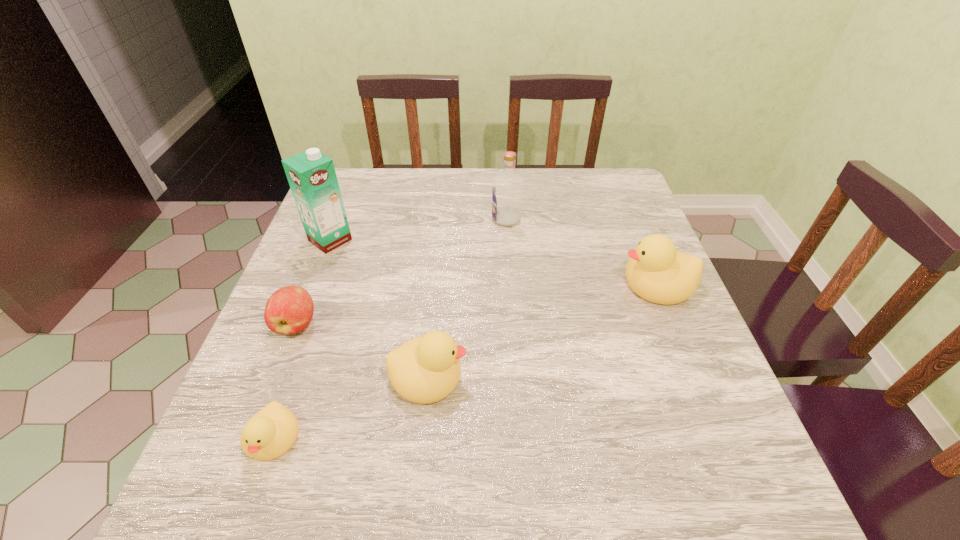
The image size is (960, 540). In order to click on vacant area that lies between the apple and the carton in this screenshot , I will do `click(313, 282)`.

The width and height of the screenshot is (960, 540). I want to click on vacant point located between the shortest object and the tallest object, so click(301, 339).

The image size is (960, 540). I want to click on blank region between the carton and the leftmost duckling, so click(301, 339).

Where is `vacant area between the second shortest object and the leftmost duckling`? The image size is (960, 540). vacant area between the second shortest object and the leftmost duckling is located at coordinates (284, 381).

Where is `unoccupied area between the tallest object and the vodka`? unoccupied area between the tallest object and the vodka is located at coordinates (419, 230).

Locate an element on the screen. Image resolution: width=960 pixels, height=540 pixels. vacant area between the second tallest duckling and the nearest duckling is located at coordinates (350, 407).

What are the coordinates of `empty location between the shortest duckling and the carton` in the screenshot? It's located at (301, 339).

In order to click on blank region between the tallest object and the vodka in this screenshot , I will do `click(419, 230)`.

At what (x,y) coordinates should I click in order to perform the action: click on the second closest object to the rightmost duckling. Please return your answer as a coordinate pair (x, y). This screenshot has height=540, width=960. Looking at the image, I should click on (426, 369).

Where is `object that stands as the closest to the fourth object from left to right`? object that stands as the closest to the fourth object from left to right is located at coordinates (271, 432).